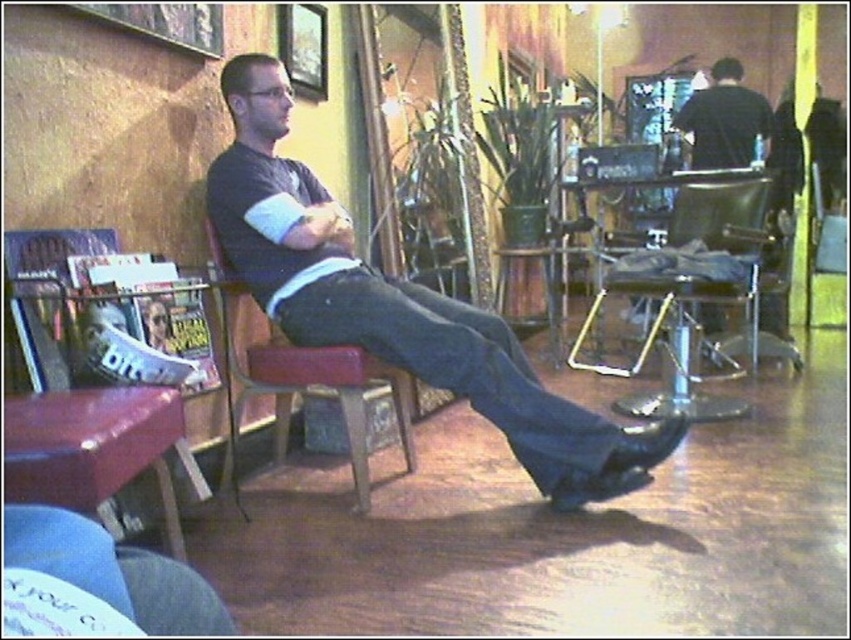
Is denim jeans at lower left smaller than shiny metallic shoe at lower center?

Actually, denim jeans at lower left might be larger than shiny metallic shoe at lower center.

Does denim jeans at lower left come behind shiny metallic shoe at lower center?

No, denim jeans at lower left is closer to the viewer.

Identify the location of denim jeans at lower left. The image size is (851, 640). (113, 572).

The height and width of the screenshot is (640, 851). Find the location of `denim jeans at lower left`. denim jeans at lower left is located at coordinates 113,572.

Between point (147, 624) and point (581, 483), which one is positioned behind?

The point (581, 483) is more distant.

Which is in front, point (107, 541) or point (592, 488)?

Point (107, 541) is in front.

Identify the location of denim jeans at lower left. (113, 572).

Does leather bar stool at lower left appear on the right side of matte black shoe at lower center?

Incorrect, leather bar stool at lower left is not on the right side of matte black shoe at lower center.

The height and width of the screenshot is (640, 851). What do you see at coordinates (92, 448) in the screenshot?
I see `leather bar stool at lower left` at bounding box center [92, 448].

Is point (174, 420) positioned in front of point (572, 509)?

That is True.

Where is `leather bar stool at lower left`? The height and width of the screenshot is (640, 851). leather bar stool at lower left is located at coordinates (92, 448).